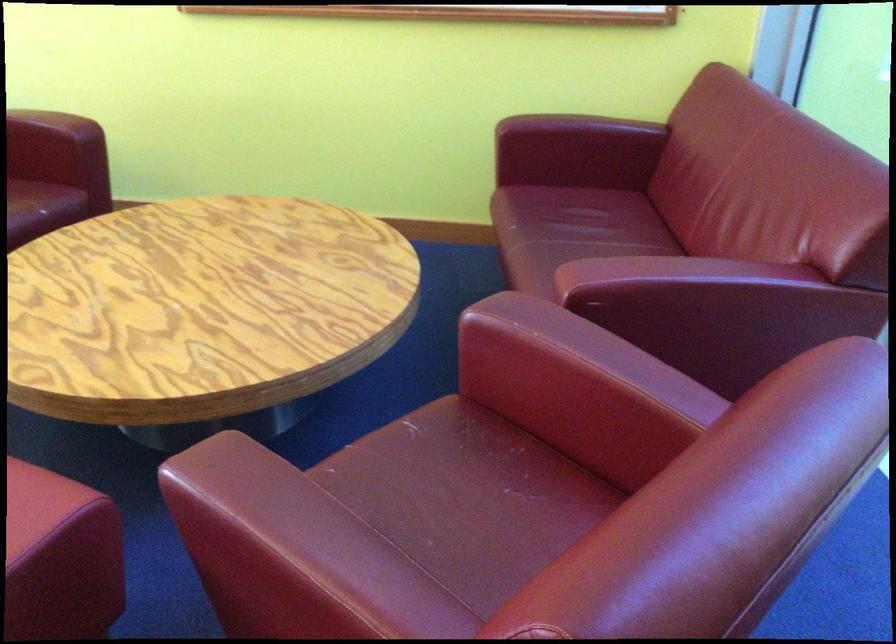
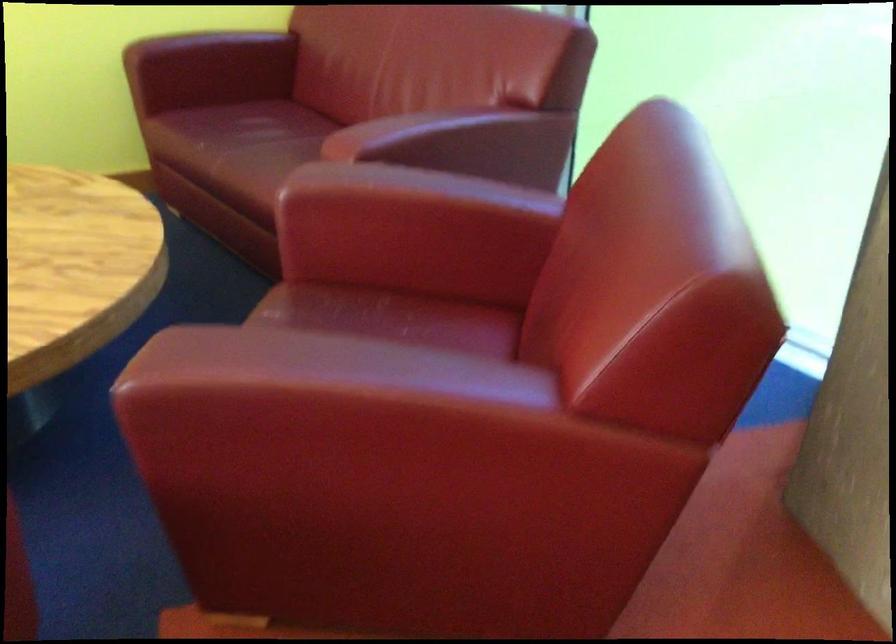
In the second image, find the point that corresponds to [566,228] in the first image.

(263, 131)